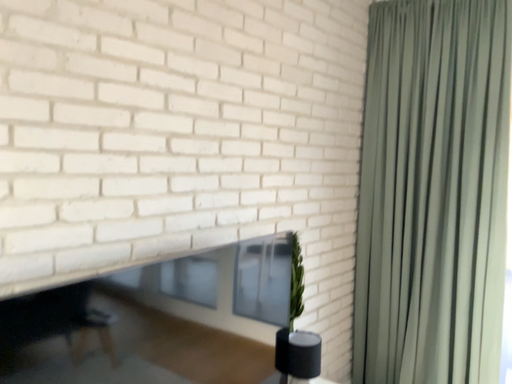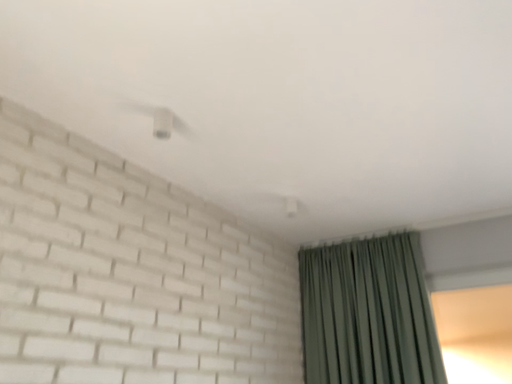
Question: How did the camera likely rotate when shooting the video?

Choices:
 (A) rotated downward
 (B) rotated upward

Answer: (B)